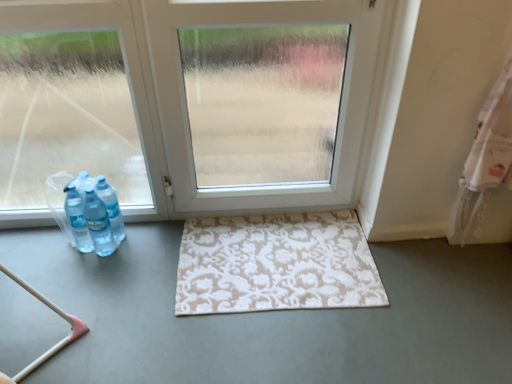
Where is `free space in front of translucent plastic bottles at left`? This screenshot has width=512, height=384. free space in front of translucent plastic bottles at left is located at coordinates (82, 275).